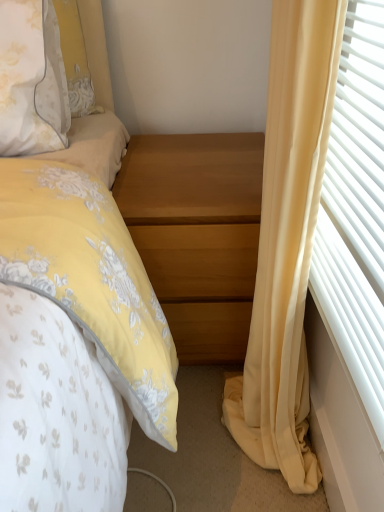
The width and height of the screenshot is (384, 512). Describe the element at coordinates (197, 233) in the screenshot. I see `wooden nightstand at center` at that location.

Measure the distance between wooden nightstand at center and camera.

They are 35.91 inches apart.

I want to click on wooden nightstand at center, so click(x=197, y=233).

At what (x,y) coordinates should I click in order to perform the action: click on wooden nightstand at center. Please return your answer as a coordinate pair (x, y). Looking at the image, I should click on (197, 233).